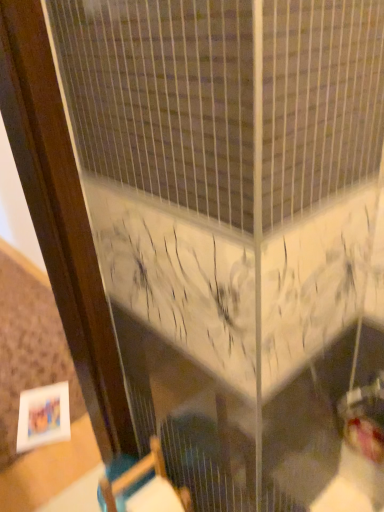
Describe the element at coordinates (145, 487) in the screenshot. This screenshot has width=384, height=512. I see `wooden chair at lower center` at that location.

What is the approximate width of wooden chair at lower center?

wooden chair at lower center is 5.88 inches wide.

The image size is (384, 512). What are the coordinates of `wooden chair at lower center` in the screenshot? It's located at (145, 487).

The height and width of the screenshot is (512, 384). Describe the element at coordinates (43, 416) in the screenshot. I see `white matte picture frame at lower left` at that location.

What is the approximate height of white matte picture frame at lower left?

white matte picture frame at lower left is 1.61 centimeters tall.

Locate an element on the screen. This screenshot has height=512, width=384. white matte picture frame at lower left is located at coordinates (43, 416).

Where is `wooden chair at lower center`? wooden chair at lower center is located at coordinates (145, 487).

Considering the positions of objects white matte picture frame at lower left and wooden chair at lower center in the image provided, who is more to the right, white matte picture frame at lower left or wooden chair at lower center?

Positioned to the right is wooden chair at lower center.

From the picture: Considering the positions of objects white matte picture frame at lower left and wooden chair at lower center in the image provided, who is in front, white matte picture frame at lower left or wooden chair at lower center?

Positioned in front is wooden chair at lower center.

Considering the points (26, 438) and (182, 501), which point is in front, point (26, 438) or point (182, 501)?

Positioned in front is point (182, 501).

From the image's perspective, which is above, white matte picture frame at lower left or wooden chair at lower center?

wooden chair at lower center appears higher in the image.

From a real-world perspective, is white matte picture frame at lower left on top of wooden chair at lower center?

No, from a real-world perspective, white matte picture frame at lower left is not above wooden chair at lower center.

In terms of width, does white matte picture frame at lower left look wider or thinner when compared to wooden chair at lower center?

white matte picture frame at lower left is wider than wooden chair at lower center.

Can you confirm if white matte picture frame at lower left is shorter than wooden chair at lower center?

Indeed, white matte picture frame at lower left has a lesser height compared to wooden chair at lower center.

Based on their sizes in the image, would you say white matte picture frame at lower left is bigger or smaller than wooden chair at lower center?

Considering their sizes, white matte picture frame at lower left takes up less space than wooden chair at lower center.

Is wooden chair at lower center surrounded by white matte picture frame at lower left?

No.

Is white matte picture frame at lower left with wooden chair at lower center?

white matte picture frame at lower left is not next to wooden chair at lower center, and they're not touching.

Is white matte picture frame at lower left oriented towards wooden chair at lower center?

No, white matte picture frame at lower left is not aimed at wooden chair at lower center.

How different are the orientations of white matte picture frame at lower left and wooden chair at lower center in degrees?

white matte picture frame at lower left and wooden chair at lower center are facing 28.7 degrees away from each other.

How far apart are white matte picture frame at lower left and wooden chair at lower center?

white matte picture frame at lower left is 22.28 inches from wooden chair at lower center.

Image resolution: width=384 pixels, height=512 pixels. What are the coordinates of `furniture that is in front of the white matte picture frame at lower left` in the screenshot? It's located at 145,487.

Which is more to the right, wooden chair at lower center or white matte picture frame at lower left?

From the viewer's perspective, wooden chair at lower center appears more on the right side.

Is the position of wooden chair at lower center more distant than that of white matte picture frame at lower left?

No, wooden chair at lower center is in front of white matte picture frame at lower left.

Which is farther from the camera, (159, 466) or (47, 413)?

The point (47, 413) is farther.

From the image's perspective, between wooden chair at lower center and white matte picture frame at lower left, which one is located above?

From the image's view, wooden chair at lower center is above.

From a real-world perspective, does wooden chair at lower center stand above white matte picture frame at lower left?

Indeed, from a real-world perspective, wooden chair at lower center stands above white matte picture frame at lower left.

Which object is thinner, wooden chair at lower center or white matte picture frame at lower left?

With smaller width is wooden chair at lower center.

Can you confirm if wooden chair at lower center is taller than white matte picture frame at lower left?

Yes, wooden chair at lower center is taller than white matte picture frame at lower left.

Looking at this image, does wooden chair at lower center have a larger size compared to white matte picture frame at lower left?

Correct, wooden chair at lower center is larger in size than white matte picture frame at lower left.

Do you think wooden chair at lower center is within white matte picture frame at lower left, or outside of it?

wooden chair at lower center exists outside the volume of white matte picture frame at lower left.

Is wooden chair at lower center placed right next to white matte picture frame at lower left?

They are not placed beside each other.

Could you tell me if wooden chair at lower center is turned towards white matte picture frame at lower left?

No, wooden chair at lower center is not facing towards white matte picture frame at lower left.

The height and width of the screenshot is (512, 384). Find the location of `picture frame to the left of wooden chair at lower center`. picture frame to the left of wooden chair at lower center is located at coordinates (43, 416).

I want to click on furniture in front of the white matte picture frame at lower left, so click(x=145, y=487).

Where is `picture frame on the left of wooden chair at lower center`? The height and width of the screenshot is (512, 384). picture frame on the left of wooden chair at lower center is located at coordinates (43, 416).